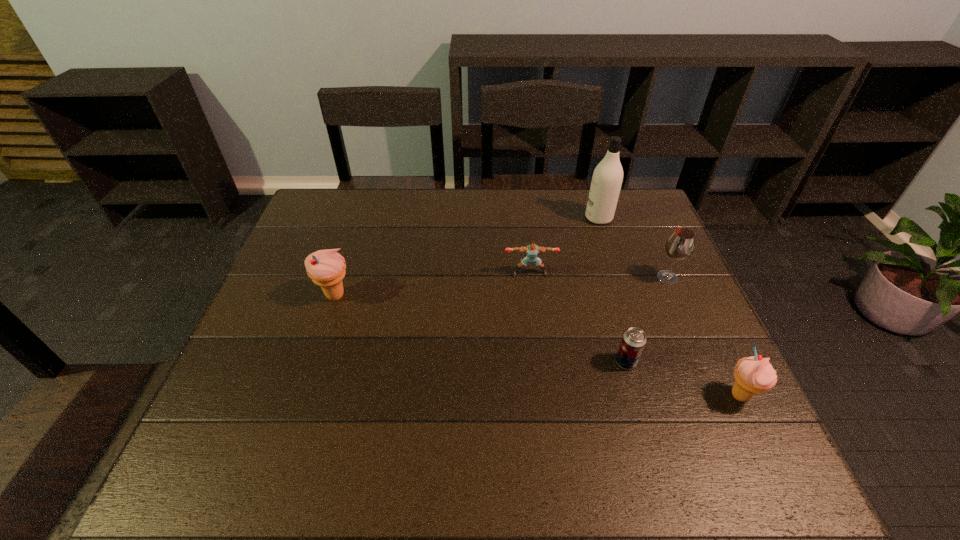
Select which object appears as the fifth closest to the left icecream. Please provide its 2D coordinates. Your answer should be formatted as a tuple, i.e. [(x, y)], where the tuple contains the x and y coordinates of a point satisfying the conditions above.

[(754, 374)]

The width and height of the screenshot is (960, 540). I want to click on free space in the image that satisfies the following two spatial constraints: 1. on the back side of the wineglass; 2. on the front-facing side of the shampoo, so click(x=641, y=218).

Where is `blank space that satisfies the following two spatial constraints: 1. on the front-facing side of the fifth farthest object; 2. on the left side of the fifth object from right to left`? This screenshot has height=540, width=960. blank space that satisfies the following two spatial constraints: 1. on the front-facing side of the fifth farthest object; 2. on the left side of the fifth object from right to left is located at coordinates pos(540,362).

At what (x,y) coordinates should I click in order to perform the action: click on vacant space that satisfies the following two spatial constraints: 1. on the front-facing side of the second object from left to right; 2. on the right side of the nearest object. Please return your answer as a coordinate pair (x, y). Image resolution: width=960 pixels, height=540 pixels. Looking at the image, I should click on (544, 395).

Identify the location of vacant space that satisfies the following two spatial constraints: 1. on the front-facing side of the tallest object; 2. on the back side of the right icecream. The image size is (960, 540). (656, 395).

Find the location of a particular element. vacant point that satisfies the following two spatial constraints: 1. on the front-facing side of the second object from left to right; 2. on the left side of the wineglass is located at coordinates (531, 278).